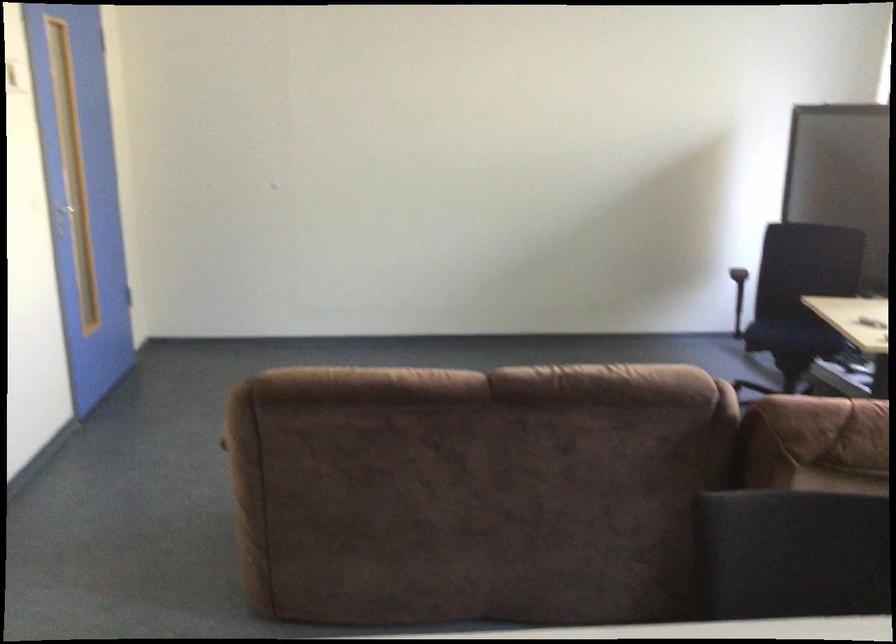
Find where to rest the black chair armrest. Please return your answer as a coordinate pair (x, y).

(737, 296)